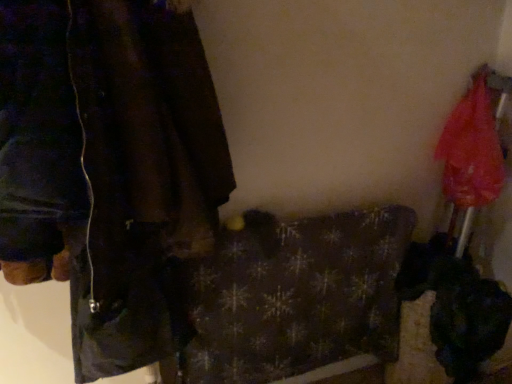
Question: Does dark plaid blanket at center have a lesser width compared to translucent nylon umbrella at right?

Choices:
 (A) yes
 (B) no

Answer: (A)

Question: Can you confirm if dark plaid blanket at center is positioned to the right of translucent nylon umbrella at right?

Choices:
 (A) yes
 (B) no

Answer: (B)

Question: Is dark plaid blanket at center not near translucent nylon umbrella at right?

Choices:
 (A) yes
 (B) no

Answer: (B)

Question: Is dark plaid blanket at center surrounding translucent nylon umbrella at right?

Choices:
 (A) yes
 (B) no

Answer: (B)

Question: Is dark plaid blanket at center outside translucent nylon umbrella at right?

Choices:
 (A) no
 (B) yes

Answer: (B)

Question: From a real-world perspective, is dark brown leather jacket at left above or below dark plaid blanket at center?

Choices:
 (A) below
 (B) above

Answer: (B)

Question: Looking at their shapes, would you say dark brown leather jacket at left is wider or thinner than dark plaid blanket at center?

Choices:
 (A) wide
 (B) thin

Answer: (A)

Question: Is point (100, 177) closer or farther from the camera than point (400, 218)?

Choices:
 (A) farther
 (B) closer

Answer: (B)

Question: Is dark brown leather jacket at left inside the boundaries of dark plaid blanket at center, or outside?

Choices:
 (A) outside
 (B) inside

Answer: (A)

Question: Considering the positions of dark plaid blanket at center and dark brown leather jacket at left in the image, is dark plaid blanket at center wider or thinner than dark brown leather jacket at left?

Choices:
 (A) thin
 (B) wide

Answer: (A)

Question: From a real-world perspective, is dark plaid blanket at center above or below dark brown leather jacket at left?

Choices:
 (A) above
 (B) below

Answer: (B)

Question: From their relative heights in the image, would you say dark plaid blanket at center is taller or shorter than dark brown leather jacket at left?

Choices:
 (A) short
 (B) tall

Answer: (B)

Question: In the image, is dark plaid blanket at center positioned in front of or behind dark brown leather jacket at left?

Choices:
 (A) front
 (B) behind

Answer: (B)

Question: From a real-world perspective, is dark brown leather jacket at left physically located above or below translucent nylon umbrella at right?

Choices:
 (A) above
 (B) below

Answer: (A)

Question: Based on their sizes in the image, would you say dark brown leather jacket at left is bigger or smaller than translucent nylon umbrella at right?

Choices:
 (A) big
 (B) small

Answer: (A)